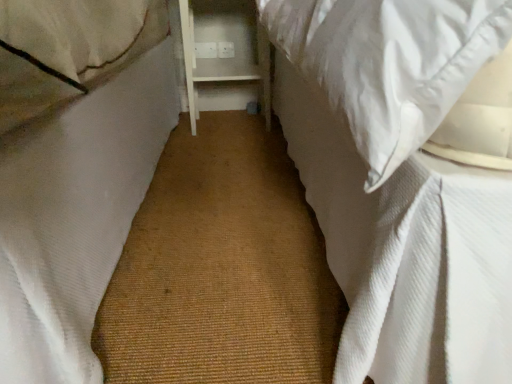
This screenshot has width=512, height=384. What are the coordinates of `white wood shelf at center` in the screenshot? It's located at (223, 67).

What do you see at coordinates (223, 67) in the screenshot?
I see `white wood shelf at center` at bounding box center [223, 67].

You are a GUI agent. You are given a task and a screenshot of the screen. Output one action in this format:
    pyautogui.click(x=<x>, y=<y>)
    Task: Click on the white wood shelf at center
    
    Given the screenshot: What is the action you would take?
    pyautogui.click(x=223, y=67)